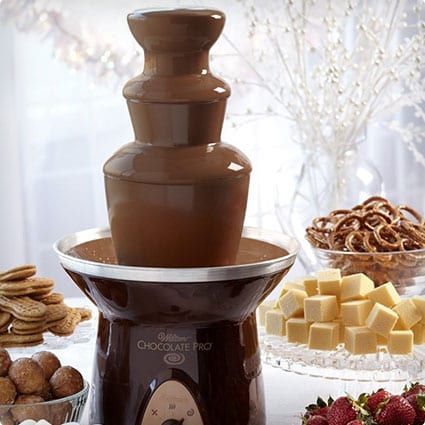
This screenshot has height=425, width=425. Find the location of `platter with cubes of cheese`. platter with cubes of cheese is located at coordinates (356, 359).